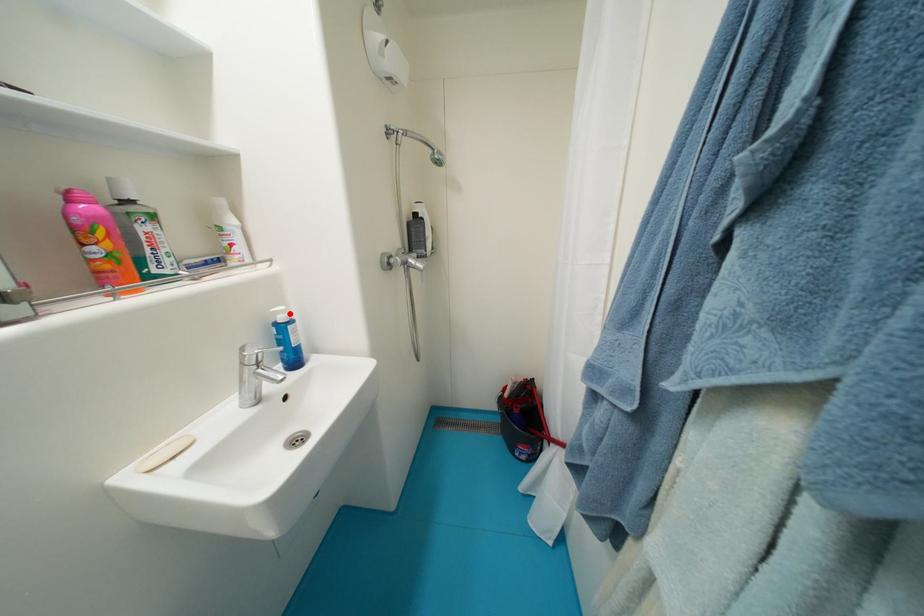
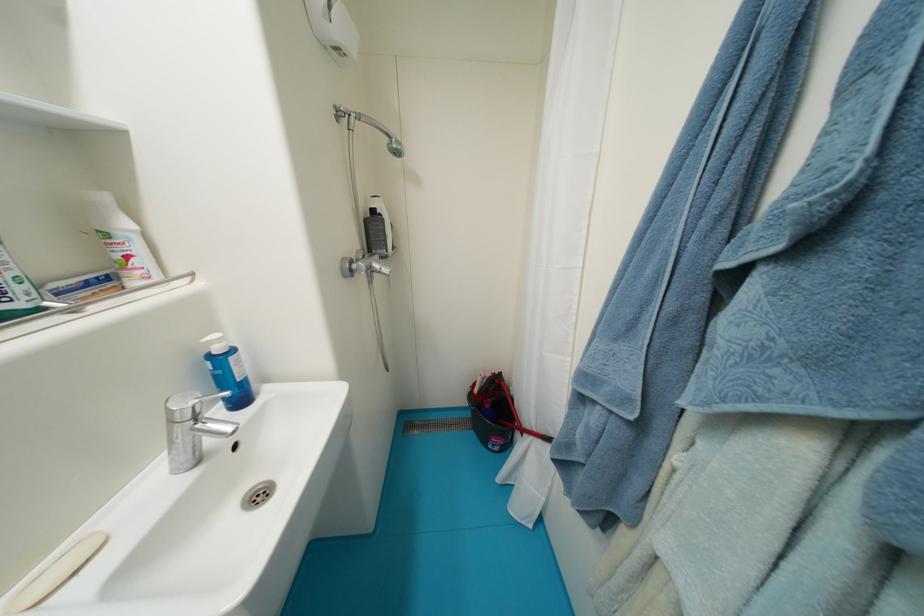
Where in the second image is the point corresponding to the highlighted location from the first image?

(225, 342)